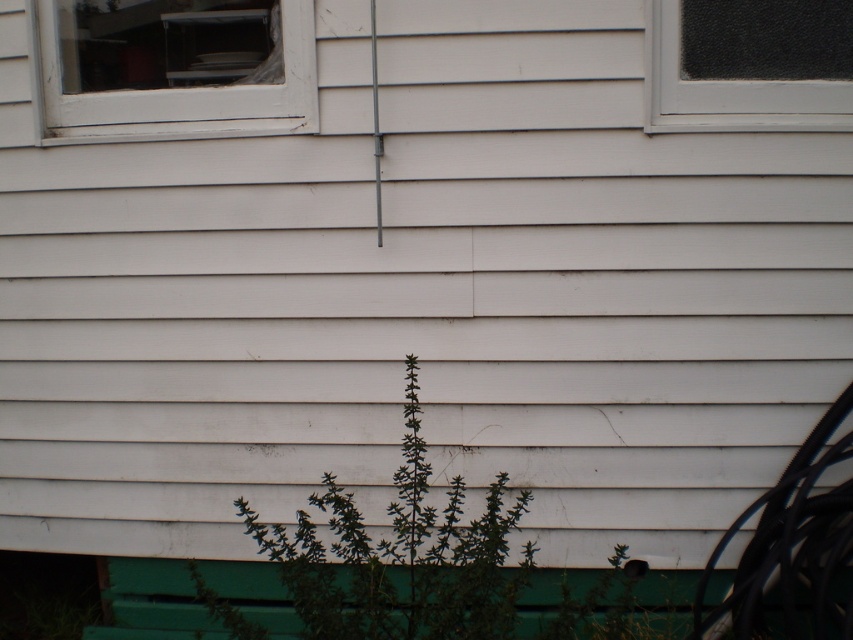
Is point (469, 620) farther from camera compared to point (848, 128)?

No, it is not.

Is green leafy plant at center wider than clear glass window at upper right?

Yes, green leafy plant at center is wider than clear glass window at upper right.

Identify the location of green leafy plant at center. The width and height of the screenshot is (853, 640). tap(401, 556).

Is green painted wood park bench at lower center to the left of clear glass window at upper right from the viewer's perspective?

Indeed, green painted wood park bench at lower center is positioned on the left side of clear glass window at upper right.

Is green painted wood park bench at lower center thinner than clear glass window at upper right?

In fact, green painted wood park bench at lower center might be wider than clear glass window at upper right.

Image resolution: width=853 pixels, height=640 pixels. In order to click on green painted wood park bench at lower center in this screenshot , I will do `click(154, 602)`.

Can you confirm if white plastic window at upper left is smaller than green painted wood park bench at lower center?

Actually, white plastic window at upper left might be larger than green painted wood park bench at lower center.

The height and width of the screenshot is (640, 853). What are the coordinates of `white plastic window at upper left` in the screenshot? It's located at (173, 67).

Find the location of a particular element. Image resolution: width=853 pixels, height=640 pixels. white plastic window at upper left is located at coordinates (173, 67).